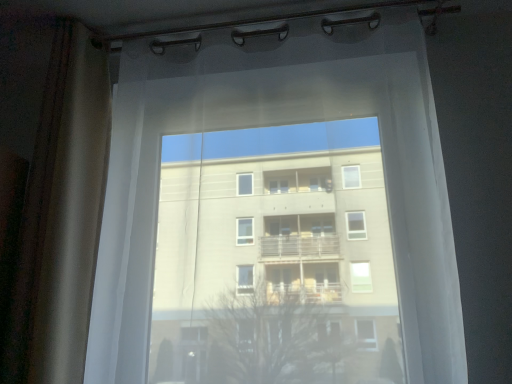
Question: Does translucent white curtain at center turn towards brown textured curtain at left?

Choices:
 (A) yes
 (B) no

Answer: (B)

Question: Considering the relative sizes of translucent white curtain at center and brown textured curtain at left in the image provided, is translucent white curtain at center wider than brown textured curtain at left?

Choices:
 (A) no
 (B) yes

Answer: (B)

Question: Is translucent white curtain at center completely or partially outside of brown textured curtain at left?

Choices:
 (A) yes
 (B) no

Answer: (A)

Question: From the image's perspective, is translucent white curtain at center located beneath brown textured curtain at left?

Choices:
 (A) no
 (B) yes

Answer: (B)

Question: Considering the relative sizes of translucent white curtain at center and brown textured curtain at left in the image provided, is translucent white curtain at center thinner than brown textured curtain at left?

Choices:
 (A) yes
 (B) no

Answer: (B)

Question: Is translucent white curtain at center taller than brown textured curtain at left?

Choices:
 (A) yes
 (B) no

Answer: (B)

Question: Does brown textured curtain at left have a greater width compared to translucent white curtain at center?

Choices:
 (A) yes
 (B) no

Answer: (B)

Question: Is brown textured curtain at left completely or partially outside of translucent white curtain at center?

Choices:
 (A) no
 (B) yes

Answer: (B)

Question: Considering the relative positions of brown textured curtain at left and translucent white curtain at center in the image provided, is brown textured curtain at left to the left of translucent white curtain at center from the viewer's perspective?

Choices:
 (A) no
 (B) yes

Answer: (B)

Question: Does brown textured curtain at left have a smaller size compared to translucent white curtain at center?

Choices:
 (A) yes
 (B) no

Answer: (A)

Question: Does brown textured curtain at left turn towards translucent white curtain at center?

Choices:
 (A) yes
 (B) no

Answer: (B)

Question: Can you confirm if brown textured curtain at left is taller than translucent white curtain at center?

Choices:
 (A) no
 (B) yes

Answer: (B)

Question: Is brown textured curtain at left in front of or behind translucent white curtain at center in the image?

Choices:
 (A) front
 (B) behind

Answer: (B)